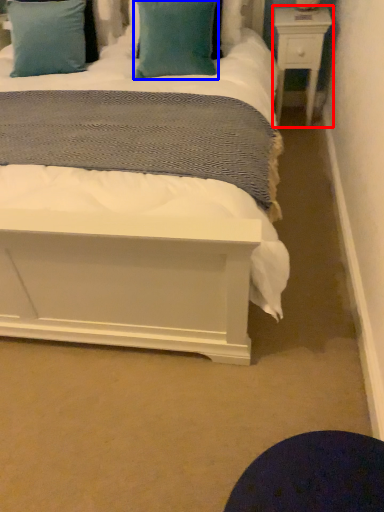
Question: Among these objects, which one is farthest to the camera, nightstand (highlighted by a red box) or pillow (highlighted by a blue box)?

Choices:
 (A) nightstand
 (B) pillow

Answer: (A)